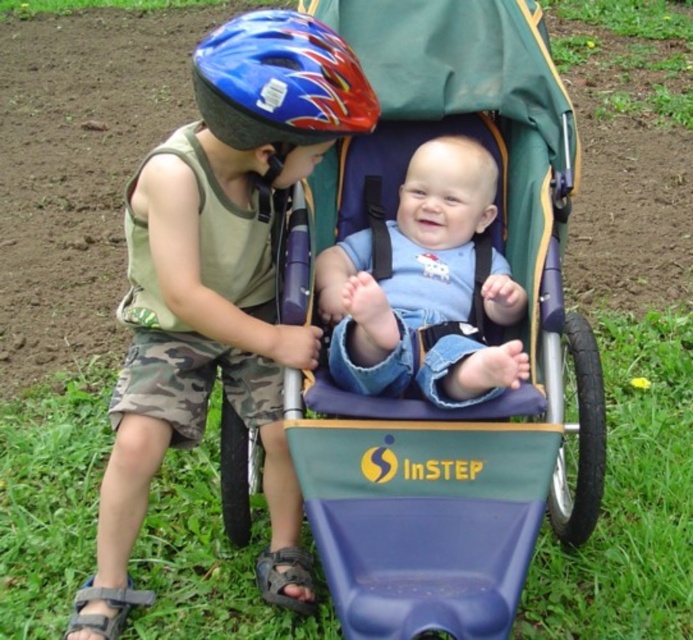
Image resolution: width=693 pixels, height=640 pixels. In order to click on blue plastic stroller at center in this screenshot , I will do `click(482, 332)`.

Find the location of a particular element. The height and width of the screenshot is (640, 693). blue plastic stroller at center is located at coordinates (482, 332).

The height and width of the screenshot is (640, 693). What do you see at coordinates (482, 332) in the screenshot?
I see `blue plastic stroller at center` at bounding box center [482, 332].

From the picture: Does blue plastic stroller at center have a greater width compared to shiny blue helmet at upper left?

Yes.

Who is more distant from viewer, (520, 8) or (243, 52)?

The point (520, 8) is more distant.

This screenshot has height=640, width=693. I want to click on blue plastic stroller at center, so click(482, 332).

Is blue denim shirt at center taller than shiny blue helmet at upper left?

Yes.

Where is `blue denim shirt at center`? The width and height of the screenshot is (693, 640). blue denim shirt at center is located at coordinates (407, 266).

I want to click on blue denim shirt at center, so click(x=407, y=266).